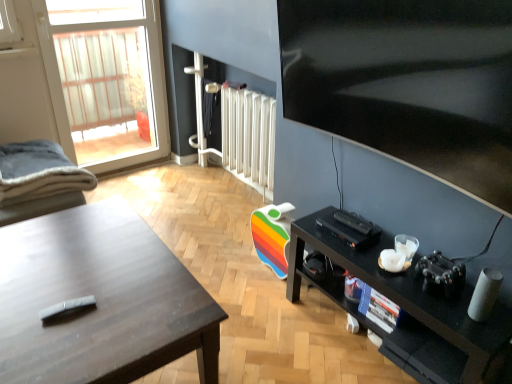
What do you see at coordinates (99, 300) in the screenshot? This screenshot has width=512, height=384. I see `matte black desk at left` at bounding box center [99, 300].

Locate an element on the screen. transparent glass door at upper left is located at coordinates (105, 80).

What is the approximate width of black matte shelf at lower right?

black matte shelf at lower right is 11.85 inches wide.

This screenshot has height=384, width=512. I want to click on black matte shelf at lower right, so click(x=409, y=311).

Describe the element at coordinates (205, 107) in the screenshot. I see `metallic silver screen door at upper center` at that location.

The height and width of the screenshot is (384, 512). I want to click on soft gray fabric chair at left, so click(39, 181).

How different are the orientations of black glossy tv at upper right and transparent glass door at upper left in degrees?

The facing directions of black glossy tv at upper right and transparent glass door at upper left are 90.8 degrees apart.

From the image's perspective, is black glossy tv at upper right above transparent glass door at upper left?

Actually, black glossy tv at upper right appears below transparent glass door at upper left in the image.

Is black glossy tv at upper right turned away from transparent glass door at upper left?

No.

In the scene shown: Is black glossy tv at upper right inside the boundaries of transparent glass door at upper left, or outside?

black glossy tv at upper right cannot be found inside transparent glass door at upper left.

Which is further, (x=42, y=142) or (x=394, y=354)?

The point (x=42, y=142) is farther.

Based on the photo, considering the relative sizes of soft gray fabric chair at left and black matte shelf at lower right in the image provided, is soft gray fabric chair at left bigger than black matte shelf at lower right?

Actually, soft gray fabric chair at left might be smaller than black matte shelf at lower right.

Is soft gray fabric chair at left oriented towards black matte shelf at lower right?

No.

What's the angular difference between soft gray fabric chair at left and black matte shelf at lower right's facing directions?

There is a 180-degree angle between the facing directions of soft gray fabric chair at left and black matte shelf at lower right.

From the image's perspective, who appears lower, matte black desk at left or transparent glass door at upper left?

matte black desk at left is shown below in the image.

Is matte black desk at left aimed at transparent glass door at upper left?

No, matte black desk at left is not oriented towards transparent glass door at upper left.

Is there a large distance between matte black desk at left and transparent glass door at upper left?

matte black desk at left is positioned a significant distance from transparent glass door at upper left.

Measure the distance from matte black desk at left to transparent glass door at upper left.

matte black desk at left is 1.71 meters away from transparent glass door at upper left.

How different are the orientations of white glossy radiator at center and soft gray fabric chair at left in degrees?

Answer: The facing directions of white glossy radiator at center and soft gray fabric chair at left are 178 degrees apart.

Measure the distance between white glossy radiator at center and soft gray fabric chair at left.

white glossy radiator at center and soft gray fabric chair at left are 3.63 feet apart from each other.

From a real-world perspective, is white glossy radiator at center positioned under soft gray fabric chair at left based on gravity?

Yes, from a real-world perspective, white glossy radiator at center is below soft gray fabric chair at left.

From the picture: Is soft gray fabric chair at left completely or partially inside white glossy radiator at center?

No, soft gray fabric chair at left is not surrounded by white glossy radiator at center.

Is soft gray fabric chair at left completely or partially outside of metallic silver screen door at upper center?

Absolutely, soft gray fabric chair at left is external to metallic silver screen door at upper center.

Is soft gray fabric chair at left facing towards metallic silver screen door at upper center?

Yes, soft gray fabric chair at left is turned towards metallic silver screen door at upper center.

Does soft gray fabric chair at left have a lesser height compared to metallic silver screen door at upper center?

Yes, soft gray fabric chair at left is shorter than metallic silver screen door at upper center.

From their relative heights in the image, would you say metallic silver screen door at upper center is taller or shorter than black glossy tv at upper right?

In the image, metallic silver screen door at upper center appears to be shorter than black glossy tv at upper right.

From the image's perspective, which is below, metallic silver screen door at upper center or black glossy tv at upper right?

From the image's view, black glossy tv at upper right is below.

Is metallic silver screen door at upper center not near black glossy tv at upper right?

Yes, metallic silver screen door at upper center and black glossy tv at upper right are quite far apart.

Does metallic silver screen door at upper center come in front of black glossy tv at upper right?

No, metallic silver screen door at upper center is further to the viewer.

Is black matte shelf at lower right placed right next to black glossy tv at upper right?

No, black matte shelf at lower right is not in contact with black glossy tv at upper right.

Between black matte shelf at lower right and black glossy tv at upper right, which one has smaller width?

black glossy tv at upper right.

Considering the positions of objects black matte shelf at lower right and black glossy tv at upper right in the image provided, who is more to the right, black matte shelf at lower right or black glossy tv at upper right?

black matte shelf at lower right is more to the right.

Which is closer to the camera, (402, 291) or (300, 26)?

Point (402, 291) is closer to the camera than point (300, 26).

What are the coordinates of `television on the right of transparent glass door at upper left` in the screenshot? It's located at (408, 83).

Find the location of `shelf below the soft gray fabric chair at left (from the image's perspective)`. shelf below the soft gray fabric chair at left (from the image's perspective) is located at coordinates (409, 311).

In the scene shown: Based on their spatial positions, is transparent glass door at upper left or white glossy radiator at center further from metallic silver screen door at upper center?

Among the two, white glossy radiator at center is located further to metallic silver screen door at upper center.

Looking at the image, which one is located further to metallic silver screen door at upper center, matte black desk at left or transparent glass door at upper left?

The object further to metallic silver screen door at upper center is matte black desk at left.

Which object lies nearer to the anchor point matte black desk at left, white glossy radiator at center or transparent glass door at upper left?

The object closer to matte black desk at left is white glossy radiator at center.

Estimate the real-world distances between objects in this image. Which object is further from transparent glass door at upper left, black glossy tv at upper right or matte black desk at left?

Among the two, black glossy tv at upper right is located further to transparent glass door at upper left.

From the image, which object appears to be nearer to transparent glass door at upper left, white glossy radiator at center or soft gray fabric chair at left?

soft gray fabric chair at left lies closer to transparent glass door at upper left than the other object.

Based on their spatial positions, is matte black desk at left or white glossy radiator at center further from black glossy tv at upper right?

matte black desk at left.

Considering their positions, is metallic silver screen door at upper center positioned further to black matte shelf at lower right than soft gray fabric chair at left?

metallic silver screen door at upper center.

When comparing their distances from soft gray fabric chair at left, does black matte shelf at lower right or white glossy radiator at center seem closer?

white glossy radiator at center.

The height and width of the screenshot is (384, 512). I want to click on chair located between matte black desk at left and transparent glass door at upper left in the depth direction, so click(x=39, y=181).

Find the location of `radiator between black glossy tv at upper right and metallic silver screen door at upper center in the front-back direction`. radiator between black glossy tv at upper right and metallic silver screen door at upper center in the front-back direction is located at coordinates (249, 138).

Locate an element on the screen. This screenshot has width=512, height=384. window between soft gray fabric chair at left and black matte shelf at lower right from left to right is located at coordinates (105, 80).

Where is `window between black glossy tv at upper right and metallic silver screen door at upper center from front to back`? window between black glossy tv at upper right and metallic silver screen door at upper center from front to back is located at coordinates (105, 80).